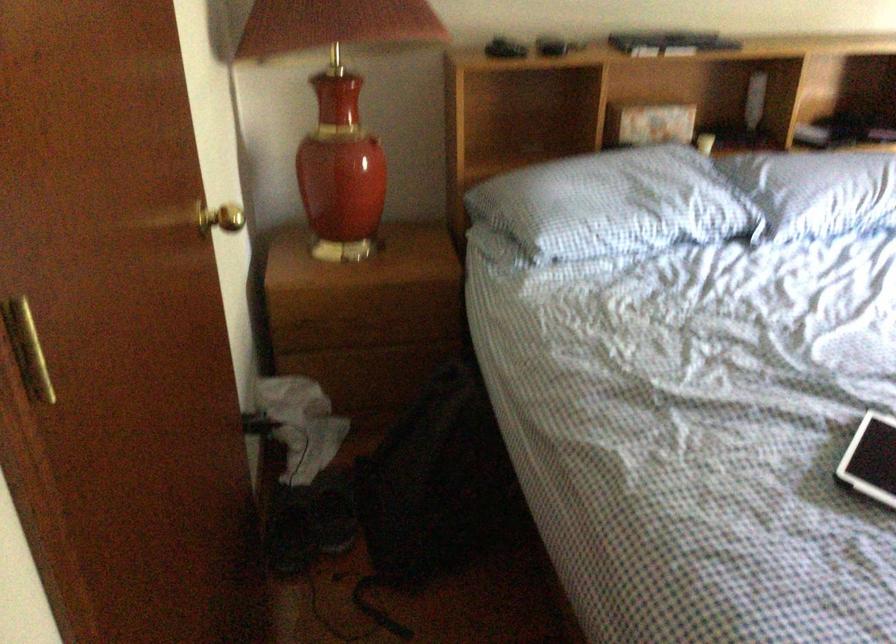
You are a GUI agent. You are given a task and a screenshot of the screen. Output one action in this format:
    pyautogui.click(x=<x>, y=<y>)
    Task: Click on the gold door knob
    
    Given the screenshot: What is the action you would take?
    pyautogui.click(x=220, y=218)